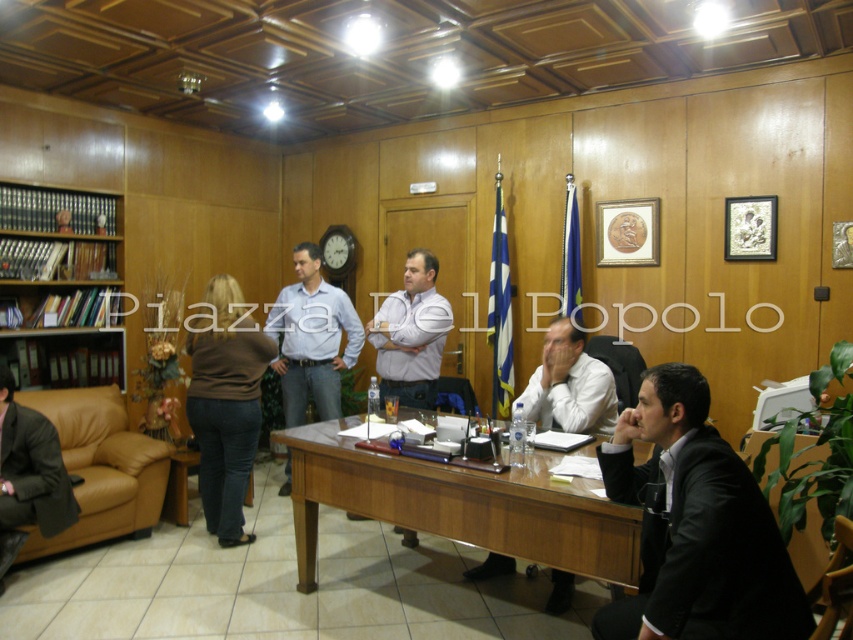
Question: Is light blue shirt at center above dark brown leather jacket at lower left?

Choices:
 (A) no
 (B) yes

Answer: (B)

Question: Which point appears closest to the camera in this image?

Choices:
 (A) (294, 262)
 (B) (12, 218)
 (C) (209, 461)

Answer: (C)

Question: Is wooden at center above light blue shirt at center?

Choices:
 (A) no
 (B) yes

Answer: (A)

Question: Can you confirm if wooden at center is positioned below wooden bookshelf at left?

Choices:
 (A) yes
 (B) no

Answer: (A)

Question: Estimate the real-world distances between objects in this image. Which object is closer to the wooden bookshelf at left?

Choices:
 (A) brown sweater at center
 (B) leather couch at left
 (C) white glossy shirt at center

Answer: (B)

Question: Which object appears farthest from the camera in this image?

Choices:
 (A) brown sweater at center
 (B) black suit at lower right
 (C) white glossy shirt at center

Answer: (A)